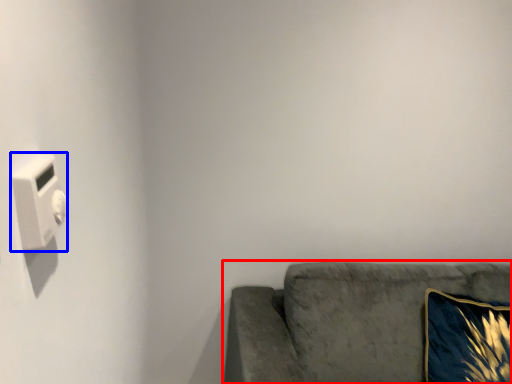
Question: Among these objects, which one is farthest to the camera, studio couch (highlighted by a red box) or light switch (highlighted by a blue box)?

Choices:
 (A) studio couch
 (B) light switch

Answer: (A)